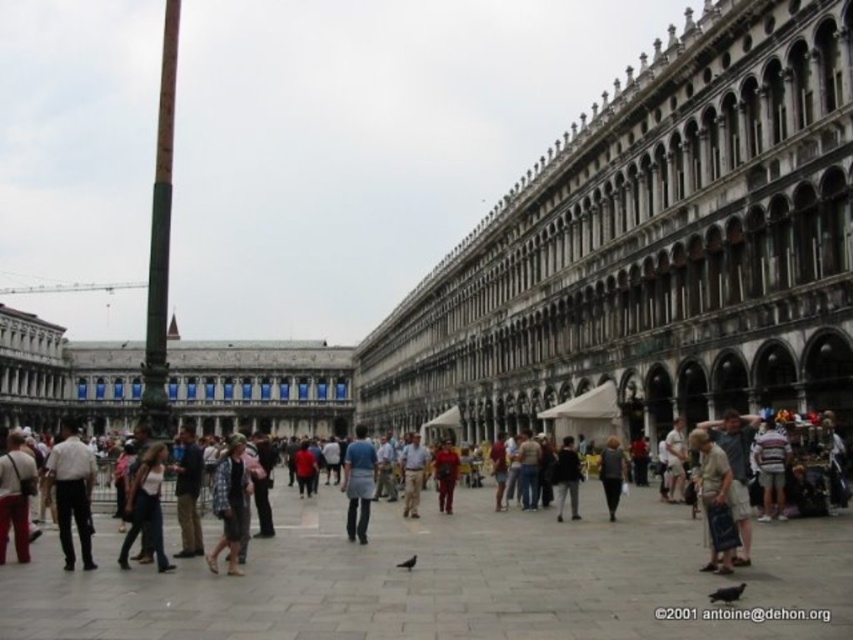
You are standing in St. Mark Square in Venice and want to take a photo of the stone arches at center. If you are currently 150 feet away from them, can you get a clear shot without moving closer?

The stone arches at center is 150.32 feet from viewer, so you are currently at the exact distance. However, since the measurement is precise to hundredths of a foot, you might need to move slightly closer or use a zoom lens for a clearer shot.

You are a tourist standing in St. Mark Square. You see the stone arches at center and the blue denim jeans at center. Which object is bigger in size?

The stone arches at center is larger in size than blue denim jeans at center.